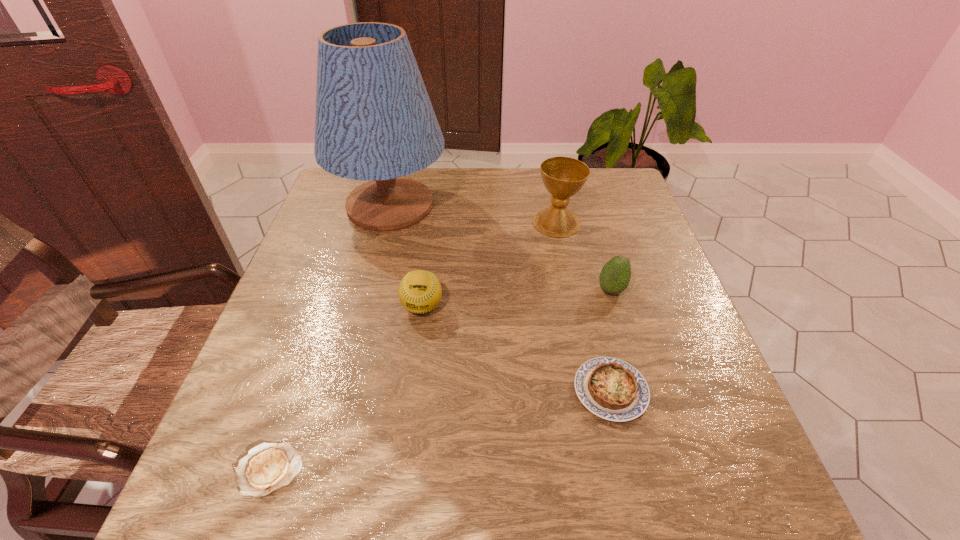
You are a GUI agent. You are given a task and a screenshot of the screen. Output one action in this format:
    pyautogui.click(x=<x>, y=<y>)
    Task: Click on the free location that satisfies the following two spatial constraints: 1. on the front side of the fifth farthest object; 2. on the right side of the tallest object
    This screenshot has width=960, height=540.
    Given the screenshot: What is the action you would take?
    pyautogui.click(x=344, y=390)

The image size is (960, 540). What are the coordinates of `vacant space that satisfies the following two spatial constraints: 1. on the back side of the left quiche; 2. on the left side of the second tallest object` in the screenshot? It's located at (353, 222).